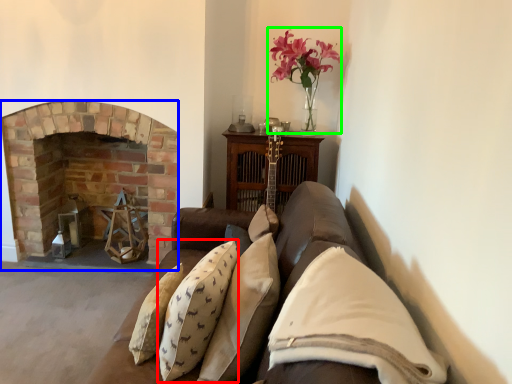
Question: Estimate the real-world distances between objects in this image. Which object is farther from pillow (highlighted by a red box), fireplace (highlighted by a blue box) or floral arrangement (highlighted by a green box)?

Choices:
 (A) fireplace
 (B) floral arrangement

Answer: (A)